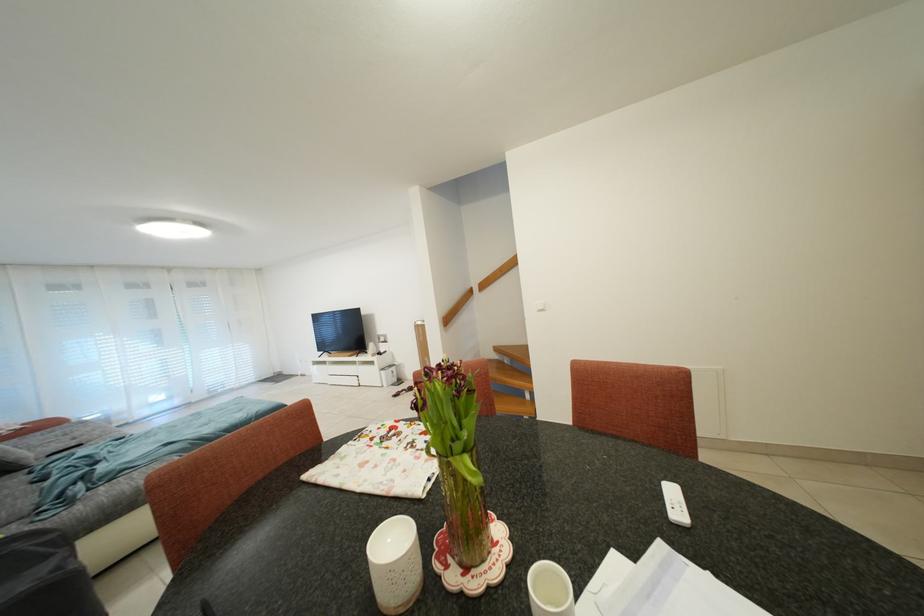
The width and height of the screenshot is (924, 616). I want to click on wooden stair handrail, so click(x=456, y=307).